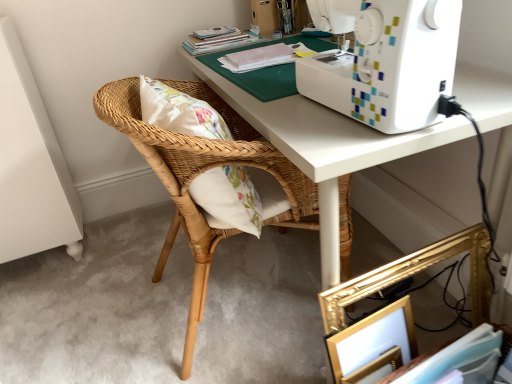
Question: From the image's perspective, does woven wood chair at center appear lower than gold metallic picture frame at lower right?

Choices:
 (A) no
 (B) yes

Answer: (A)

Question: Can you confirm if woven wood chair at center is bigger than gold metallic picture frame at lower right?

Choices:
 (A) no
 (B) yes

Answer: (B)

Question: Is woven wood chair at center to the right of gold metallic picture frame at lower right from the viewer's perspective?

Choices:
 (A) yes
 (B) no

Answer: (B)

Question: Is woven wood chair at center at the left side of gold metallic picture frame at lower right?

Choices:
 (A) yes
 (B) no

Answer: (A)

Question: Is woven wood chair at center oriented away from gold metallic picture frame at lower right?

Choices:
 (A) yes
 (B) no

Answer: (B)

Question: Considering the positions of white matte sewing machine at upper right and woven wood chair at center in the image, is white matte sewing machine at upper right taller or shorter than woven wood chair at center?

Choices:
 (A) short
 (B) tall

Answer: (A)

Question: Is white matte sewing machine at upper right wider or thinner than woven wood chair at center?

Choices:
 (A) wide
 (B) thin

Answer: (A)

Question: From the image's perspective, is white matte sewing machine at upper right located above or below woven wood chair at center?

Choices:
 (A) below
 (B) above

Answer: (B)

Question: Looking at the image, does white matte sewing machine at upper right seem bigger or smaller compared to woven wood chair at center?

Choices:
 (A) big
 (B) small

Answer: (A)

Question: Is woven wood chair at center taller or shorter than matte white book at upper center, placed as the second book when sorted from left to right?

Choices:
 (A) tall
 (B) short

Answer: (A)

Question: Relative to matte white book at upper center, the 2th book from the top, is woven wood chair at center in front or behind?

Choices:
 (A) behind
 (B) front

Answer: (B)

Question: Do you think woven wood chair at center is within matte white book at upper center, placed as the second book when sorted from left to right, or outside of it?

Choices:
 (A) inside
 (B) outside

Answer: (B)

Question: From a real-world perspective, is woven wood chair at center physically located above or below matte white book at upper center, placed as the second book when sorted from left to right?

Choices:
 (A) above
 (B) below

Answer: (B)

Question: In the image, is hardcover book at upper center, marked as the first book in a left-to-right arrangement, positioned in front of or behind woven wood chair at center?

Choices:
 (A) front
 (B) behind

Answer: (B)

Question: From a real-world perspective, is hardcover book at upper center, the first book from the back, physically located above or below woven wood chair at center?

Choices:
 (A) below
 (B) above

Answer: (B)